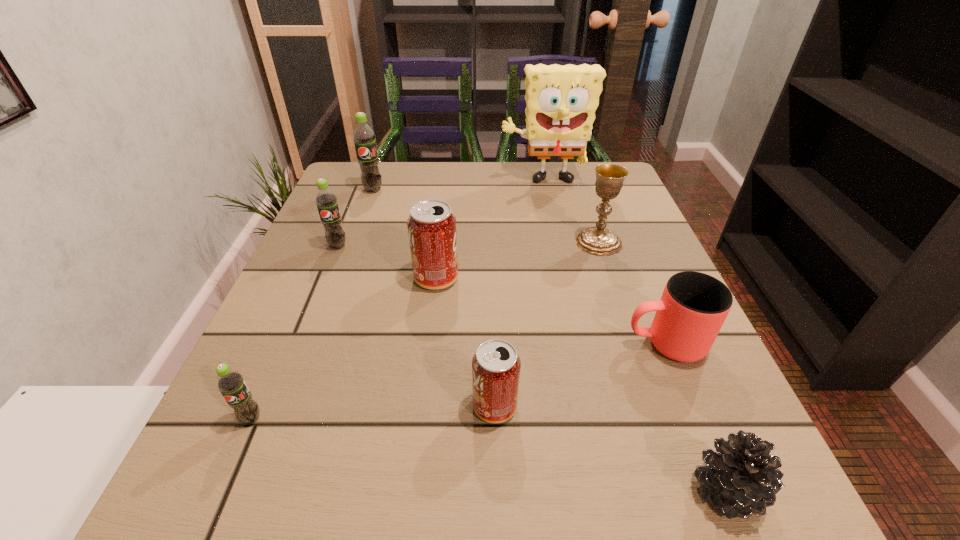
The height and width of the screenshot is (540, 960). What are the coordinates of `vacant position at the right edge of the desktop` in the screenshot? It's located at (647, 353).

Find the location of a particular element. Image resolution: width=960 pixels, height=540 pixels. free space at the far left corner of the desktop is located at coordinates (382, 194).

You are a GUI agent. You are given a task and a screenshot of the screen. Output one action in this format:
    pyautogui.click(x=<x>, y=<y>)
    Task: Click on the free space at the far right corner of the desktop
    
    Given the screenshot: What is the action you would take?
    pyautogui.click(x=585, y=174)

Where is `vacant space at the near right corner of the desktop`? The image size is (960, 540). vacant space at the near right corner of the desktop is located at coordinates (787, 501).

Locate an element on the screen. This screenshot has width=960, height=540. unoccupied position between the rightmost soda and the chalice is located at coordinates pos(546,324).

Where is `vacant region between the nearest green soda and the brown pinecone`? vacant region between the nearest green soda and the brown pinecone is located at coordinates (489, 455).

Find the location of a particular element. This screenshot has width=960, height=540. unoccupied area between the second smallest green soda and the right red soda can is located at coordinates (417, 326).

Find the location of a particular element. This screenshot has width=960, height=540. free space between the yellow sponge and the tallest soda is located at coordinates (458, 186).

At what (x,y) coordinates should I click in order to perform the action: click on vacant space that is in between the farthest green soda and the sponge. Please return your answer as a coordinate pair (x, y). Image resolution: width=960 pixels, height=540 pixels. Looking at the image, I should click on (458, 186).

Find the location of `empty space that is in between the farthest soda and the chalice`. empty space that is in between the farthest soda and the chalice is located at coordinates (486, 216).